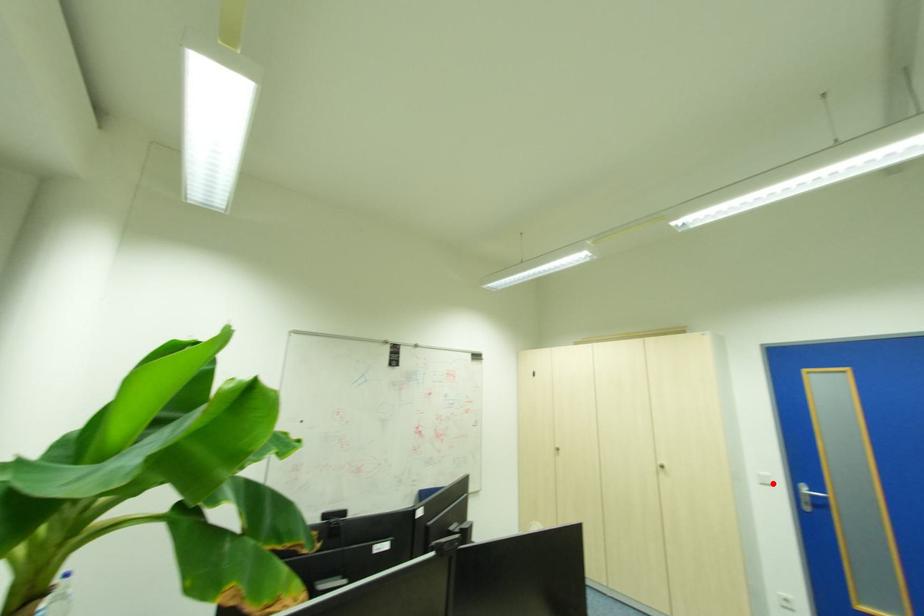
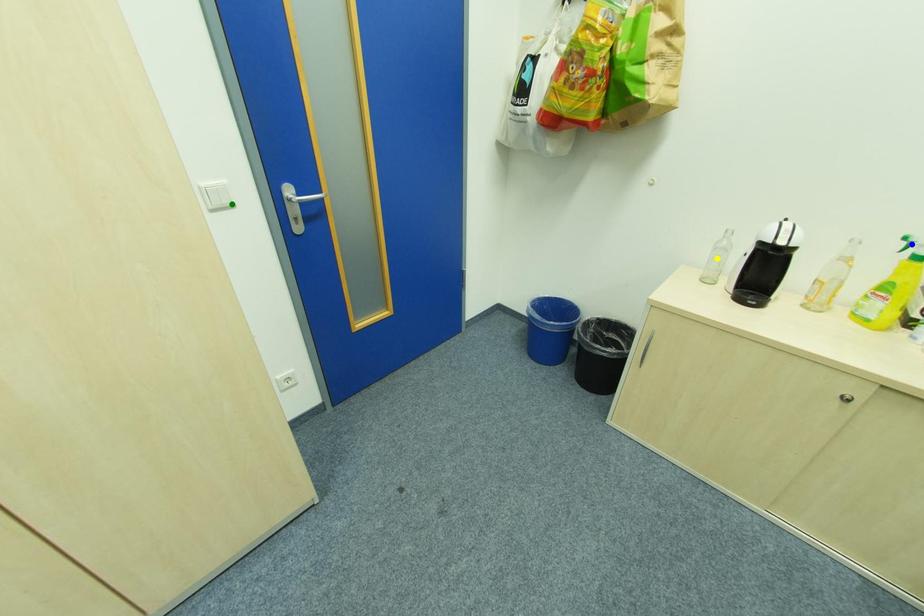
Question: I am providing you with two images of the same scene from different viewpoints. A red point is marked on the first image. You are given multiple points on the second image. In image 2, which mark is for the same physical point as the one in image 1?

Choices:
 (A) blue point
 (B) green point
 (C) yellow point

Answer: (B)